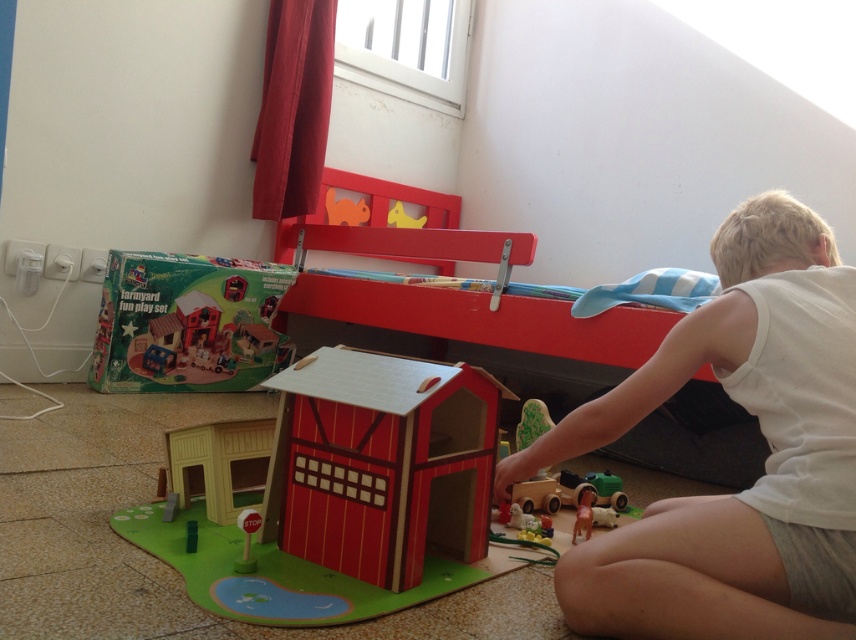
You are a parent trying to decide whether to place a new toy box between the white cotton shirt at lower right and the matte red bunk bed at upper center. Since the toy box requires a space that is at least as wide as the widest object between them, which object determines the minimum width needed for the toy box?

The matte red bunk bed at upper center is wider than the white cotton shirt at lower right, so the toy box must be at least as wide as the matte red bunk bed at upper center to fit between them.

You are setting up a toy farm scene and need to place a new animal figurine. The wooden barn at center is already in place. Where should you position the new animal figurine to ensure it is directly in front of the barn?

The wooden barn at center is located at point (x=351, y=497), so you should position the new animal figurine slightly forward along the x or y axis relative to these coordinates to place it directly in front of the barn.

You are a parent setting up a play area for your child. You have a wooden barn at center and a matte cardboard farmyard fun play set at lower left. Which object is wider?

The wooden barn at center is wider than the matte cardboard farmyard fun play set at lower left.